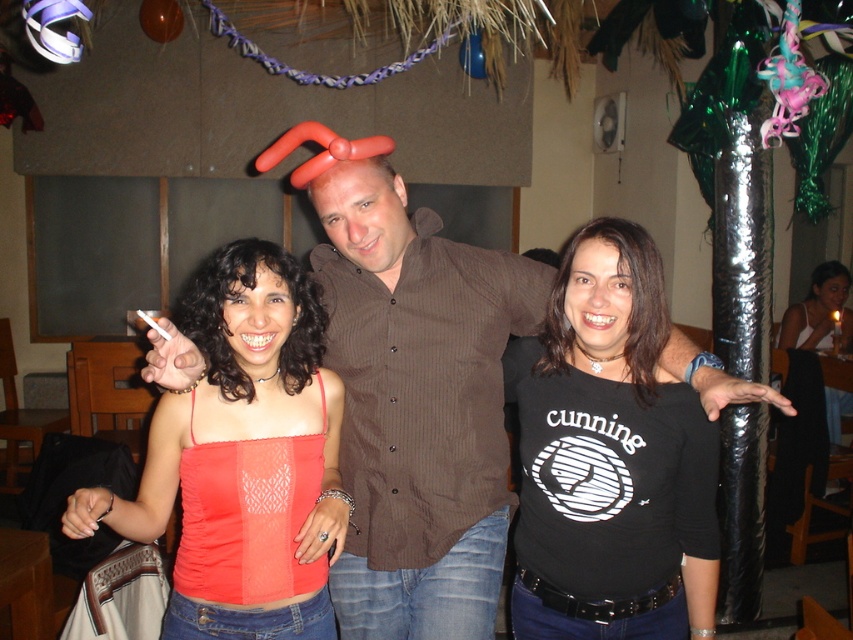
Which is behind, point (227, 292) or point (828, 289)?

The point (828, 289) is behind.

Does orange sheer top at center have a lesser width compared to black matte tank top at center?

Yes, orange sheer top at center is thinner than black matte tank top at center.

Between point (285, 336) and point (811, 304), which one is positioned in front?

Positioned in front is point (285, 336).

The width and height of the screenshot is (853, 640). I want to click on orange sheer top at center, so [242, 458].

Who is positioned more to the left, brown textured shirt at center or black matte tank top at center?

brown textured shirt at center is more to the left.

You are a GUI agent. You are given a task and a screenshot of the screen. Output one action in this format:
    pyautogui.click(x=<x>, y=<y>)
    Task: Click on the brown textured shirt at center
    The image size is (853, 640).
    Given the screenshot: What is the action you would take?
    pyautogui.click(x=418, y=408)

Does black matte shirt at center have a lesser height compared to black matte tank top at center?

Incorrect, black matte shirt at center's height does not fall short of black matte tank top at center's.

Is black matte shirt at center smaller than black matte tank top at center?

Correct, black matte shirt at center occupies less space than black matte tank top at center.

Does point (677, 429) lie behind point (820, 307)?

No, it is not.

Where is `black matte shirt at center`? This screenshot has height=640, width=853. black matte shirt at center is located at coordinates (610, 458).